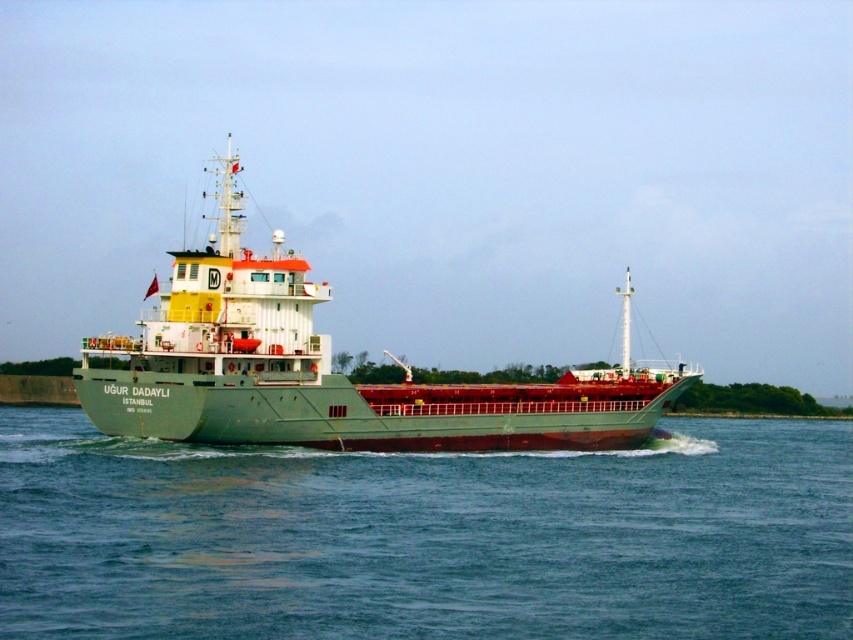
You are a sailor on the green matte ship at center. You want to know if you can see the green water at center from the deck. Can you see it?

The green water at center is shorter than green matte ship at center, so yes, you can see the green water at center from the deck since the ship is taller than the water.